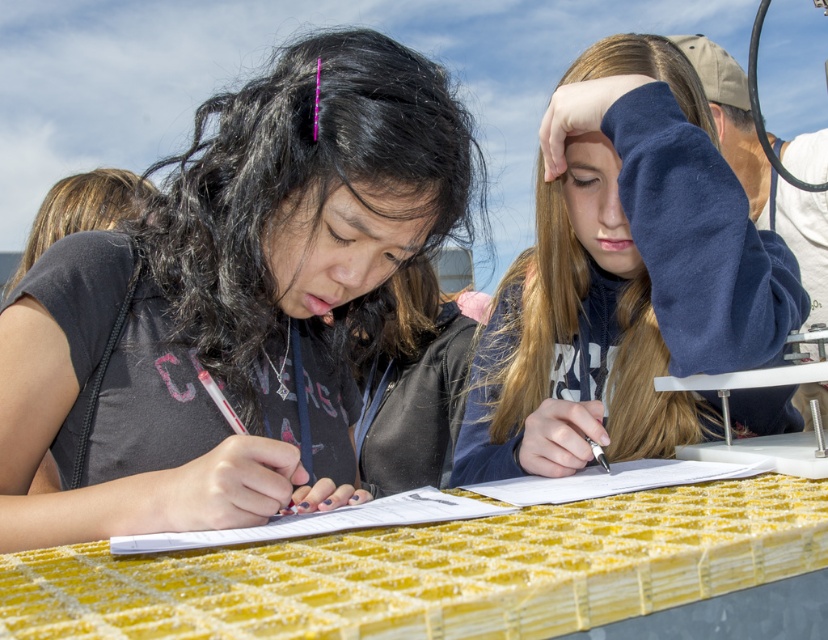
Question: Which point is farther from the camera taking this photo?

Choices:
 (A) (395, 493)
 (B) (234, 493)

Answer: (A)

Question: Does matte black shirt at center lie in front of white paper at center?

Choices:
 (A) yes
 (B) no

Answer: (B)

Question: Among these points, which one is farthest from the camera?

Choices:
 (A) 437,515
 (B) 335,225

Answer: (B)

Question: Does matte black shirt at center lie behind yellow textured table at center?

Choices:
 (A) no
 (B) yes

Answer: (B)

Question: Can you confirm if navy fleece hoodie at upper right is positioned to the left of white paper at center?

Choices:
 (A) no
 (B) yes

Answer: (A)

Question: Which is nearer to the matte black shirt at center?

Choices:
 (A) navy fleece hoodie at upper right
 (B) white paper at center

Answer: (B)